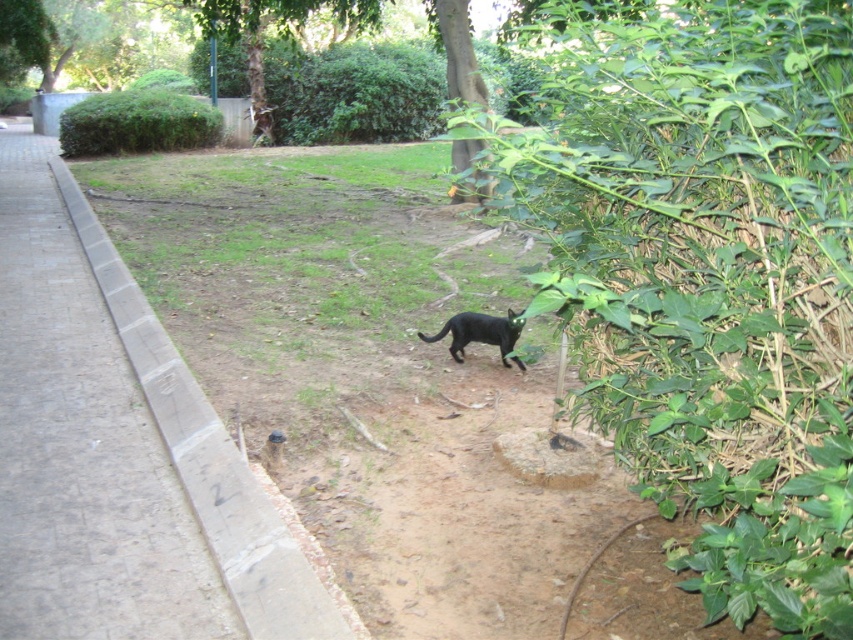
You are a photographer trying to capture both the black fur cat at center and the shiny black cat at center in a single shot. Since the camera can only focus on one subject at a time, which cat should you focus on first if you want to include both in your frame?

You should focus on the black fur cat at center first because it is positioned to the left of the shiny black cat at center, allowing you to adjust the focus to include both in the frame.

You are standing at the point labeled as point (694,636) in the park. You want to throw a ball to your friend who is standing 10 feet away from you. Can you reach your friend with a single throw?

The distance between you and your friend is 10 feet, but the point (694,636) is only 7.47 feet away from the viewer. Therefore, you cannot reach your friend with a single throw as the distance is greater than the maximum reach.

You are a photographer trying to capture both the black fur cat at center and the shiny black cat at center in a single shot. Which cat will appear larger in the photo?

The black fur cat at center will appear larger in the photo because it is closer to the viewer than the shiny black cat at center.